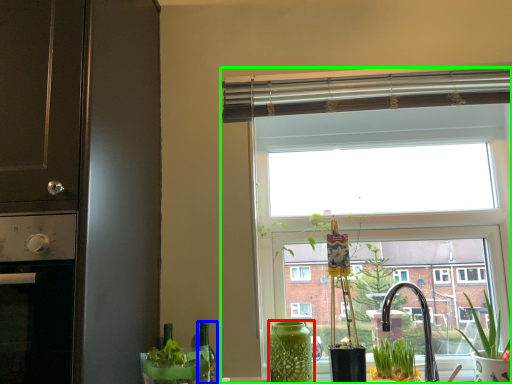
Question: Estimate the real-world distances between objects in this image. Which object is farther from vase (highlighted by a red box), bottle (highlighted by a blue box) or window (highlighted by a green box)?

Choices:
 (A) bottle
 (B) window

Answer: (B)